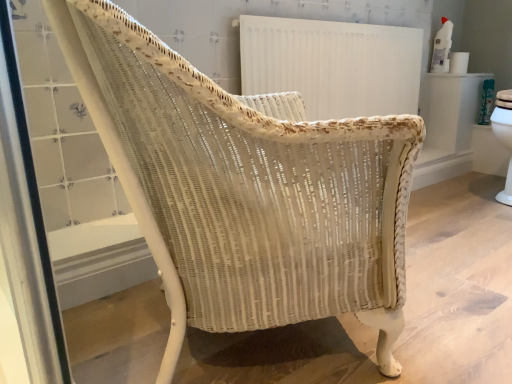
Question: Can you confirm if white paper towel at upper right is smaller than white textured radiator at upper center?

Choices:
 (A) yes
 (B) no

Answer: (A)

Question: Is white paper towel at upper right shorter than white textured radiator at upper center?

Choices:
 (A) no
 (B) yes

Answer: (B)

Question: Is white paper towel at upper right taller than white textured radiator at upper center?

Choices:
 (A) no
 (B) yes

Answer: (A)

Question: Is white paper towel at upper right closer to the viewer compared to white textured radiator at upper center?

Choices:
 (A) no
 (B) yes

Answer: (A)

Question: Would you say white paper towel at upper right is a long distance from white textured radiator at upper center?

Choices:
 (A) yes
 (B) no

Answer: (B)

Question: Can you see white paper towel at upper right touching white textured radiator at upper center?

Choices:
 (A) yes
 (B) no

Answer: (B)

Question: Is the surface of white textured radiator at upper center in direct contact with white paper towel at upper right?

Choices:
 (A) yes
 (B) no

Answer: (B)

Question: Is white textured radiator at upper center to the right of white paper towel at upper right from the viewer's perspective?

Choices:
 (A) no
 (B) yes

Answer: (A)

Question: Considering the relative sizes of white textured radiator at upper center and white paper towel at upper right in the image provided, is white textured radiator at upper center bigger than white paper towel at upper right?

Choices:
 (A) yes
 (B) no

Answer: (A)

Question: Is white textured radiator at upper center turned away from white paper towel at upper right?

Choices:
 (A) no
 (B) yes

Answer: (A)

Question: Would you say white textured radiator at upper center is a long distance from white paper towel at upper right?

Choices:
 (A) no
 (B) yes

Answer: (A)

Question: Is the depth of white textured radiator at upper center greater than that of white paper towel at upper right?

Choices:
 (A) no
 (B) yes

Answer: (A)

Question: Does point (461, 66) appear closer or farther from the camera than point (413, 89)?

Choices:
 (A) closer
 (B) farther

Answer: (B)